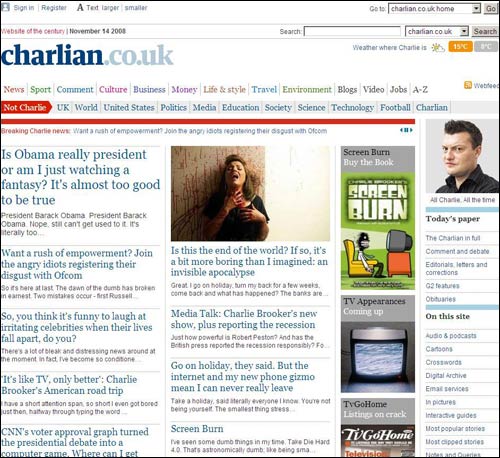
This screenshot has width=500, height=458. Find the location of `white wall`. white wall is located at coordinates (310, 193).